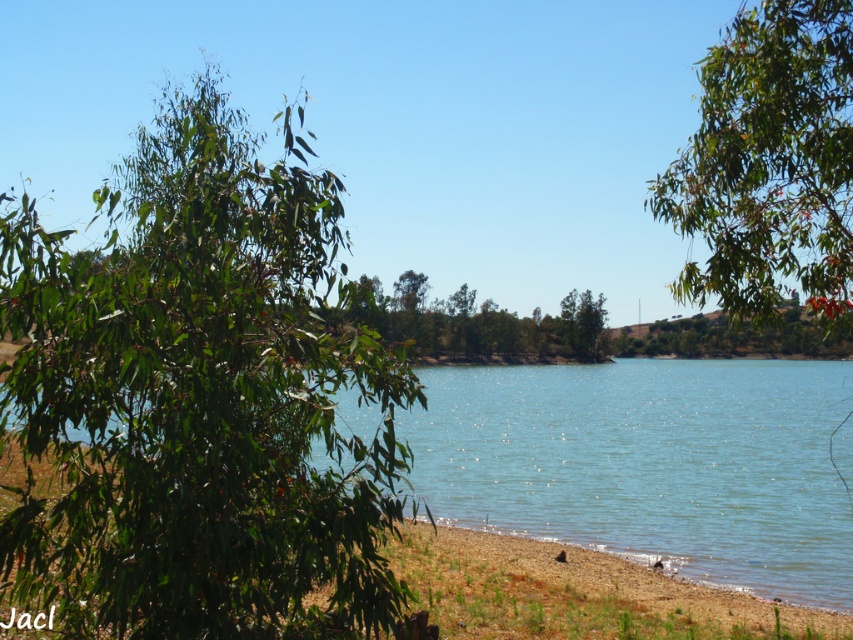
You are an artist planning to paint this lakeside scene. You want to ensure the green glossy leaves at upper right and the green leafy tree at center are proportionally accurate. Which object should be drawn smaller to maintain the scene proportions?

The green glossy leaves at upper right should be drawn smaller than the green leafy tree at center to maintain the scene proportions.

You are standing at the lakeside and want to take a photo of the green glossy leaves at upper right and the green leafy tree at center. Which object should you focus on first to ensure both are in clear view?

You should focus on the green glossy leaves at upper right first because it is closer to you than the green leafy tree at center, so adjusting focus from near to far will help both be in clear view.

You are standing at the edge of the lake and see two points marked in the image. Which point is closer to you, point (x=306, y=497) or point (x=498, y=336)?

Point (x=306, y=497) is in front of point (x=498, y=336), so it is closer to you.